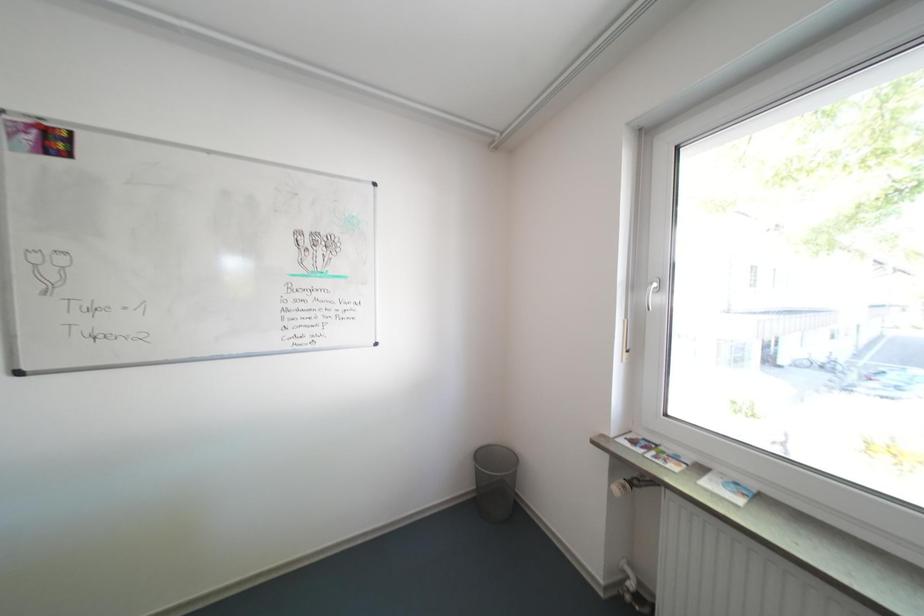
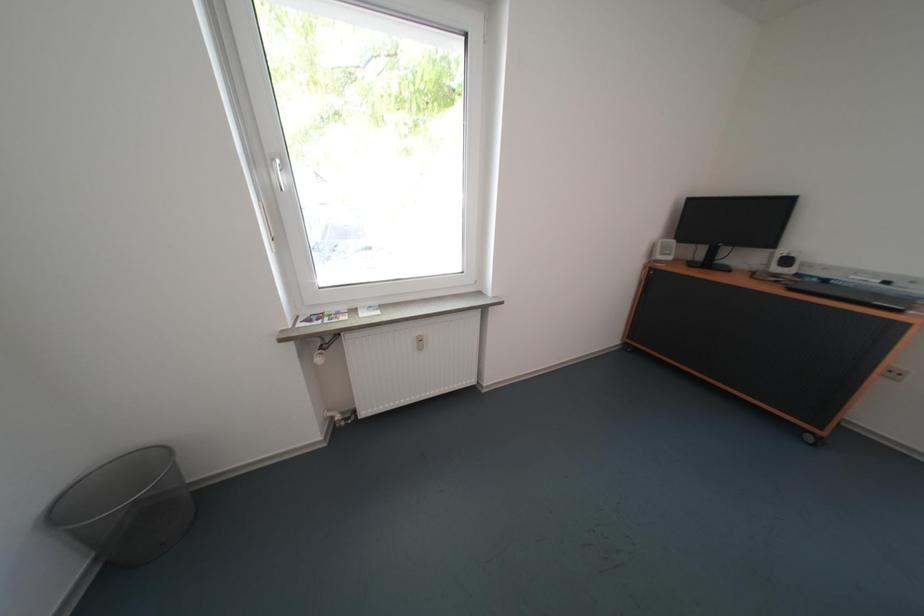
First-person continuous shooting, in which direction is the camera rotating?

The camera's rotation is toward right-down.